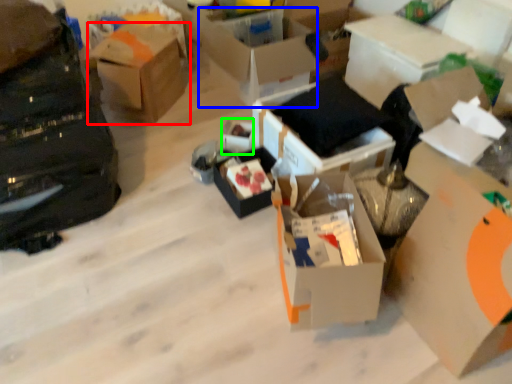
Question: Which is farther away from box (highlighted by a red box)? box (highlighted by a blue box) or storage box (highlighted by a green box)?

Choices:
 (A) box
 (B) storage box

Answer: (B)